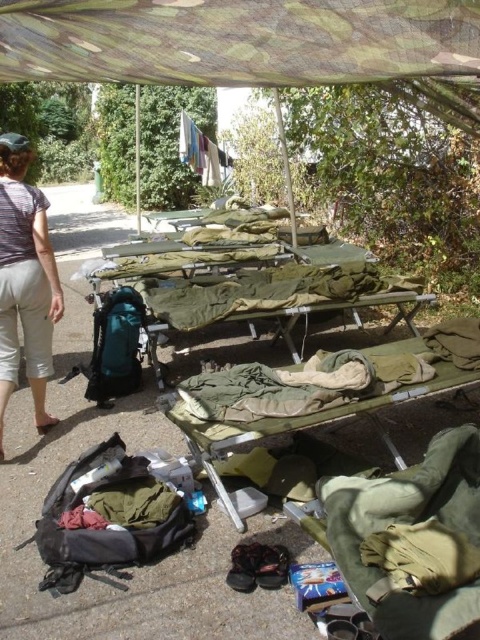
Based on the scene description, can you determine which object is wider between the camouflage fabric canopy at upper center and the camouflage fabric cot at center?

The camouflage fabric canopy at upper center is wider than the camouflage fabric cot at center since its width surpasses the cot.

You are a delivery person who needs to place a package on the ground near the camouflage fabric cot at center. Based on the coordinates provided, where should you place the package relative to the cot?

The camouflage fabric cot at center is located at coordinates point (319, 392). To place the package near it, position it close to these coordinates.